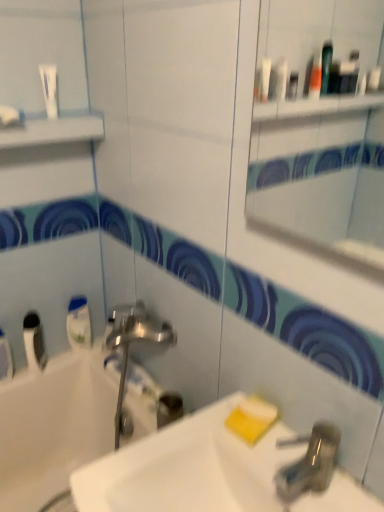
Locate an element on the screen. This screenshot has height=512, width=384. unoccupied space behind metallic faucet at lower right is located at coordinates (259, 438).